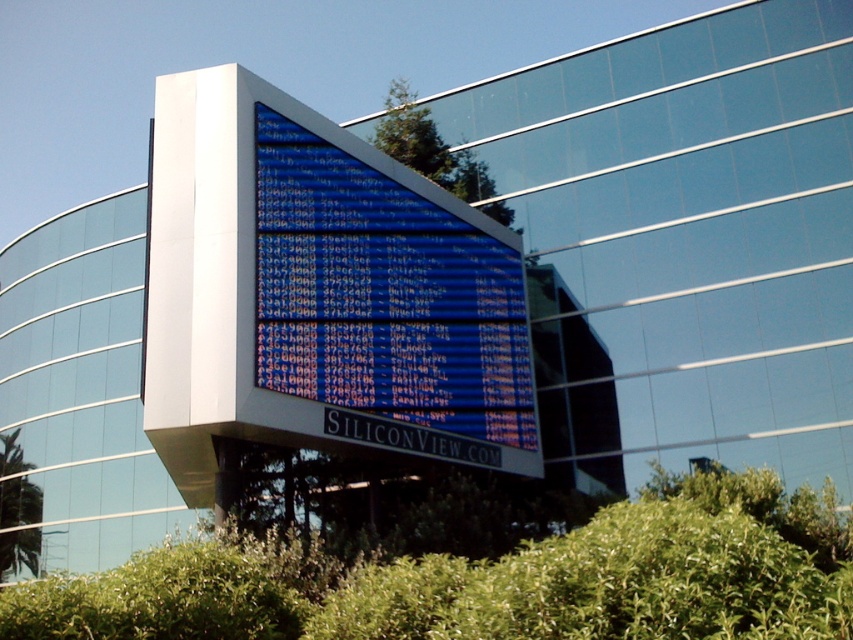
Question: Can you confirm if green leafy tree at upper center is positioned below green leafy tree at lower left?

Choices:
 (A) no
 (B) yes

Answer: (A)

Question: Estimate the real-world distances between objects in this image. Which object is closer to the green leafy tree at lower left?

Choices:
 (A) blue glossy sign at center
 (B) green leafy tree at upper center

Answer: (B)

Question: Considering the real-world distances, which object is closest to the blue glossy sign at center?

Choices:
 (A) green leafy tree at lower left
 (B) green leafy tree at upper center

Answer: (B)

Question: Can you confirm if green leafy tree at upper center is positioned below green leafy tree at lower left?

Choices:
 (A) yes
 (B) no

Answer: (B)

Question: Which of the following is the closest to the observer?

Choices:
 (A) (486, 285)
 (B) (419, 140)

Answer: (A)

Question: Can you confirm if blue glossy sign at center is wider than green leafy tree at lower left?

Choices:
 (A) no
 (B) yes

Answer: (B)